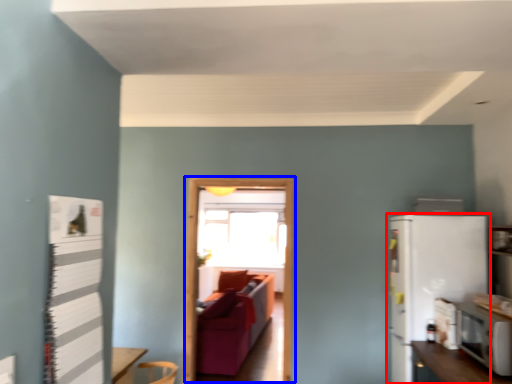
Question: Which point is further to the camera, refrigerator (highlighted by a red box) or glass door (highlighted by a blue box)?

Choices:
 (A) refrigerator
 (B) glass door

Answer: (B)